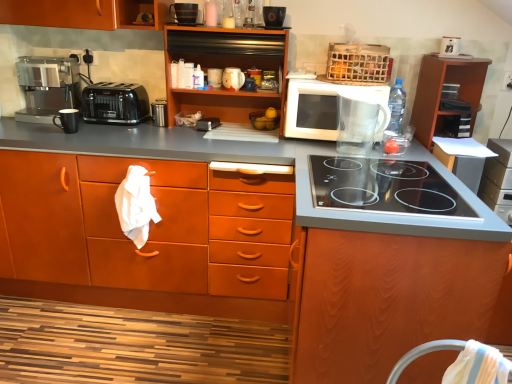
The image size is (512, 384). I want to click on free space above black plastic toaster at left (from a real-world perspective), so click(x=110, y=85).